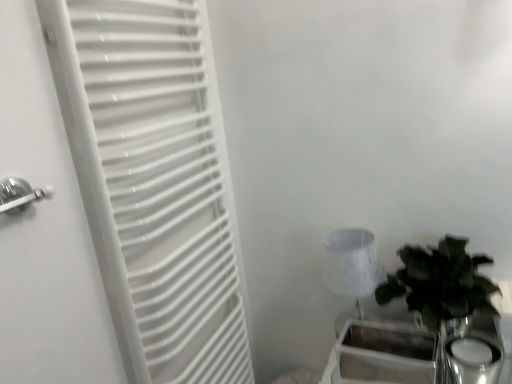
Question: From a real-world perspective, relative to metallic silver tray at lower right, is white fabric lampshade at right vertically above or below?

Choices:
 (A) below
 (B) above

Answer: (B)

Question: Considering the positions of white fabric lampshade at right and metallic silver tray at lower right in the image, is white fabric lampshade at right bigger or smaller than metallic silver tray at lower right?

Choices:
 (A) big
 (B) small

Answer: (A)

Question: Which of these objects is positioned farthest from the metallic silver tray at lower right?

Choices:
 (A) white fabric lampshade at right
 (B) green leafy plant in glass vase at right
 (C) white matte radiator at left

Answer: (C)

Question: Based on their relative distances, which object is nearer to the white fabric lampshade at right?

Choices:
 (A) green leafy plant in glass vase at right
 (B) white matte radiator at left
 (C) metallic silver tray at lower right

Answer: (A)